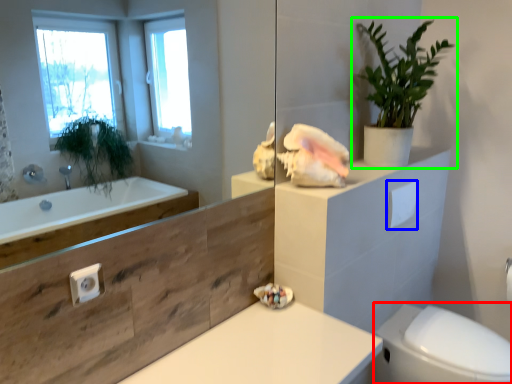
Question: Which object is the farthest from bidet (highlighted by a red box)? Choose among these: toilet paper (highlighted by a blue box) or houseplant (highlighted by a green box).

Choices:
 (A) toilet paper
 (B) houseplant

Answer: (B)